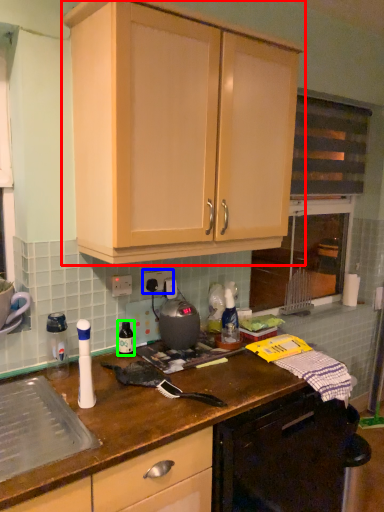
Question: Which object is the closest to the cabinetry (highlighted by a red box)? Choose among these: electric outlet (highlighted by a blue box) or bottle (highlighted by a green box).

Choices:
 (A) electric outlet
 (B) bottle

Answer: (A)